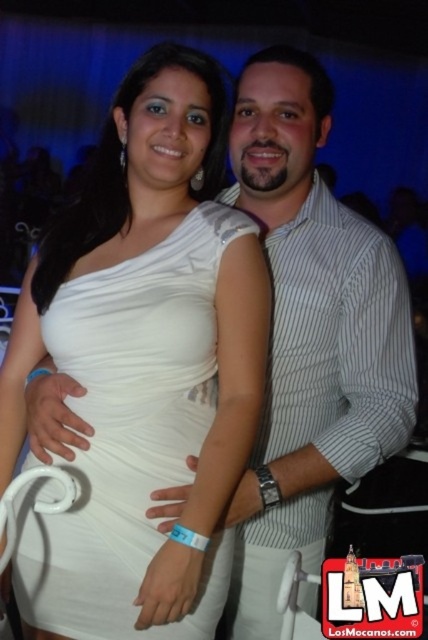
Question: Does white striped shirt at center appear under white satin dress at center?

Choices:
 (A) yes
 (B) no

Answer: (B)

Question: Which point appears farthest from the camera in this image?

Choices:
 (A) (234, 104)
 (B) (73, 534)

Answer: (A)

Question: Does white striped shirt at center have a smaller size compared to white satin dress at center?

Choices:
 (A) no
 (B) yes

Answer: (A)

Question: Which point appears closest to the camera in this image?

Choices:
 (A) (80, 531)
 (B) (315, 202)

Answer: (A)

Question: Which object appears farthest from the camera in this image?

Choices:
 (A) white satin dress at center
 (B) white striped shirt at center

Answer: (B)

Question: Does white striped shirt at center have a lesser width compared to white satin dress at center?

Choices:
 (A) yes
 (B) no

Answer: (B)